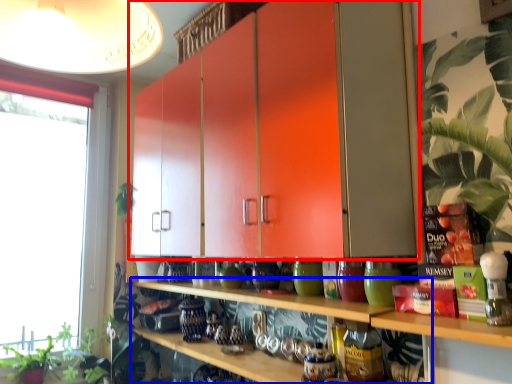
Question: Among these objects, which one is nearest to the camera, cabinetry (highlighted by a red box) or shelf (highlighted by a blue box)?

Choices:
 (A) cabinetry
 (B) shelf

Answer: (A)